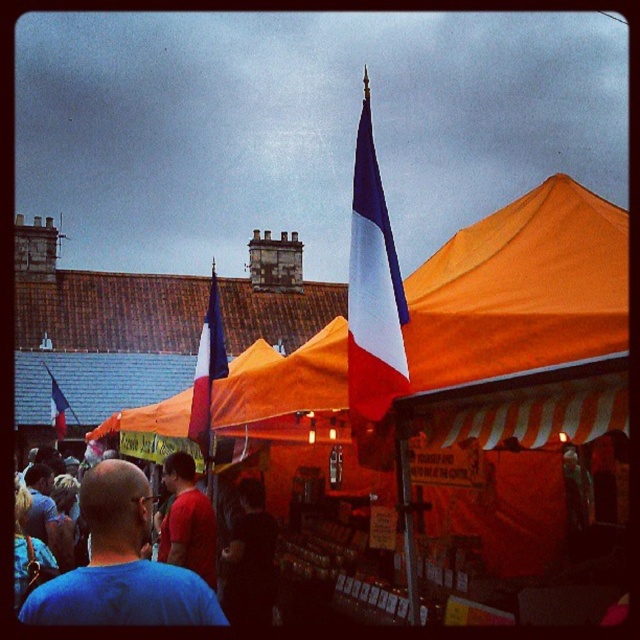
Is blue-white-red fabric flag at center taller than red cotton shirt at center?

Indeed, blue-white-red fabric flag at center has a greater height compared to red cotton shirt at center.

Where is `blue-white-red fabric flag at center`? blue-white-red fabric flag at center is located at coordinates (372, 289).

Where is `blue-white-red fabric flag at center`? The height and width of the screenshot is (640, 640). blue-white-red fabric flag at center is located at coordinates (372, 289).

Which of these two, blue t-shirt at center or blue-white-red fabric flag at center, stands taller?

With more height is blue-white-red fabric flag at center.

Is point (104, 576) farther from camera compared to point (400, 355)?

Yes.

This screenshot has width=640, height=640. I want to click on blue t-shirt at center, so click(120, 564).

This screenshot has width=640, height=640. In order to click on blue t-shirt at center in this screenshot , I will do `click(120, 564)`.

Describe the element at coordinates (208, 369) in the screenshot. I see `french flag at center` at that location.

Can you confirm if french flag at center is positioned to the right of matte red flag at left?

Indeed, french flag at center is positioned on the right side of matte red flag at left.

Where is `french flag at center`? This screenshot has height=640, width=640. french flag at center is located at coordinates (208, 369).